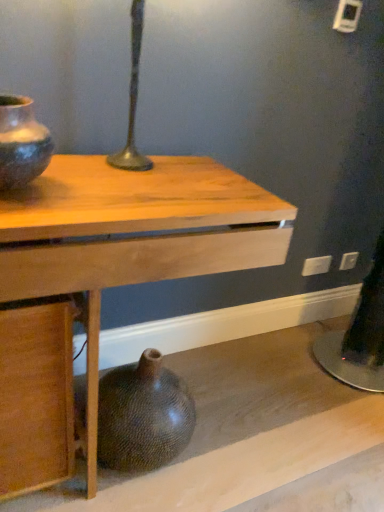
At what (x,y) coordinates should I click in order to perform the action: click on vacant area on the back side of matte black vase at left, which is counted as the 2th vase, starting from the bottom. Please return your answer as a coordinate pair (x, y). Looking at the image, I should click on (77, 170).